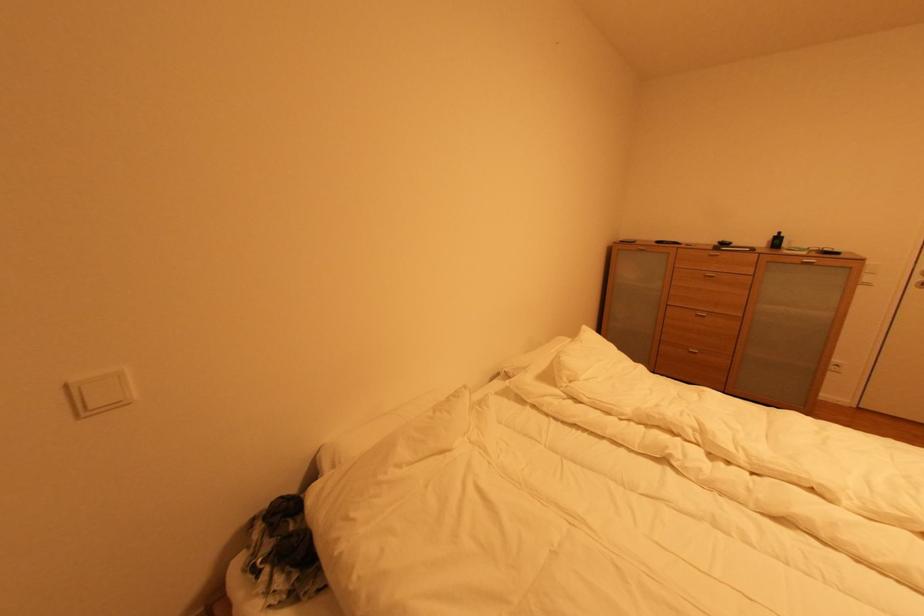
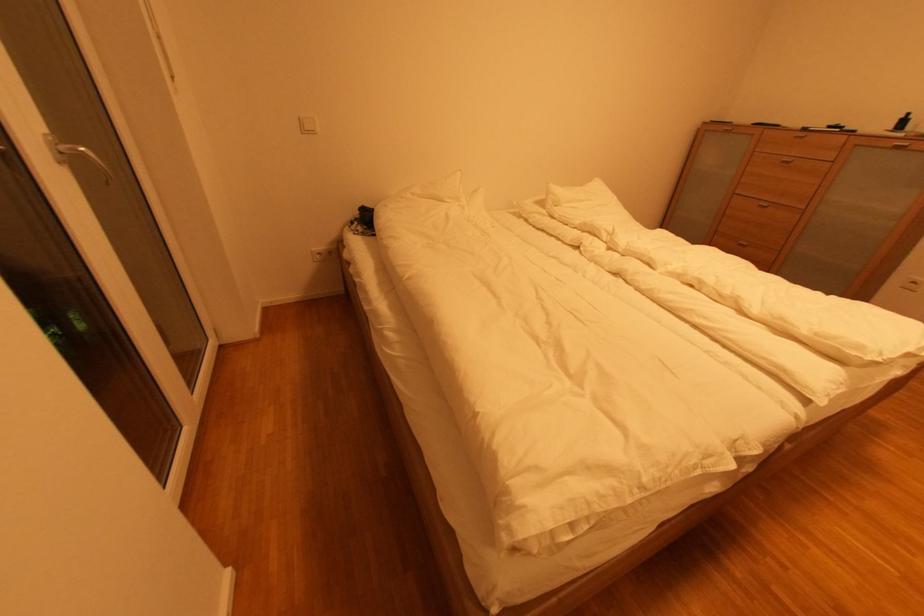
What movement of the cameraman would produce the second image?

The cameraman walked toward right, backward.